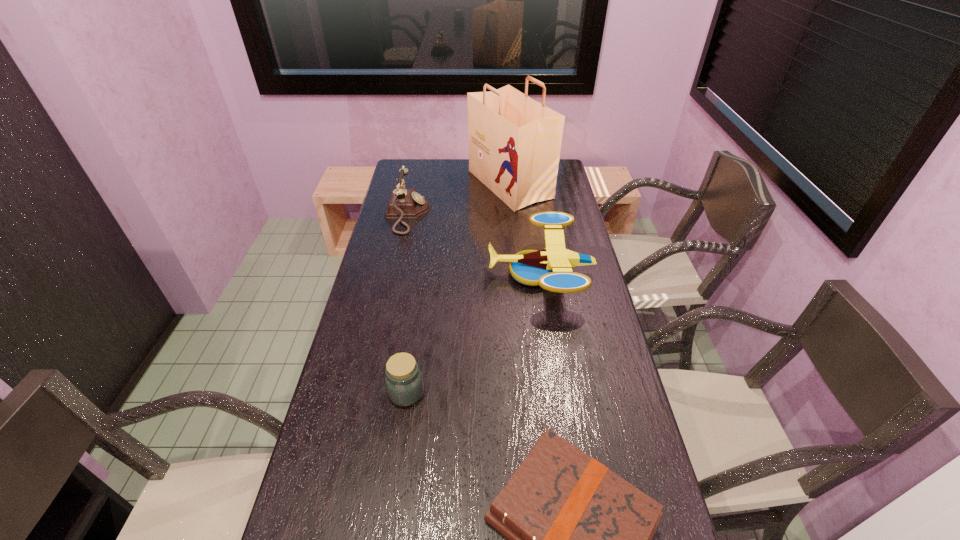
Locate an element on the screen. The image size is (960, 540). grocery bag is located at coordinates (514, 141).

Where is `the second tallest object`? The width and height of the screenshot is (960, 540). the second tallest object is located at coordinates (404, 203).

The height and width of the screenshot is (540, 960). Find the location of `jar`. jar is located at coordinates (404, 383).

Locate an element on the screen. drone is located at coordinates (551, 268).

This screenshot has width=960, height=540. I want to click on vacant space situated 0.340m on the side of the tallest object with the superhero design, so click(392, 185).

At what (x,y) coordinates should I click in order to perform the action: click on vacant space located on the side of the tallest object with the superhero design. Please return your answer as a coordinate pair (x, y). Image resolution: width=960 pixels, height=540 pixels. Looking at the image, I should click on (447, 185).

At what (x,y) coordinates should I click in order to perform the action: click on vacant region located 0.270m on the side of the tallest object with the superhero design. Please return your answer as a coordinate pair (x, y). Image resolution: width=960 pixels, height=540 pixels. Looking at the image, I should click on (407, 185).

Where is `free space located 0.110m on the dial of the telephone`? The width and height of the screenshot is (960, 540). free space located 0.110m on the dial of the telephone is located at coordinates (457, 214).

Identify the location of blank space located on the back of the fourth farthest object. This screenshot has width=960, height=540. (422, 279).

You are a GUI agent. You are given a task and a screenshot of the screen. Output one action in this format:
    pyautogui.click(x=<x>, y=<y>)
    Task: Click on the vacant space located at the cockpit of the drone
    This screenshot has height=540, width=960.
    Given the screenshot: What is the action you would take?
    pyautogui.click(x=395, y=273)